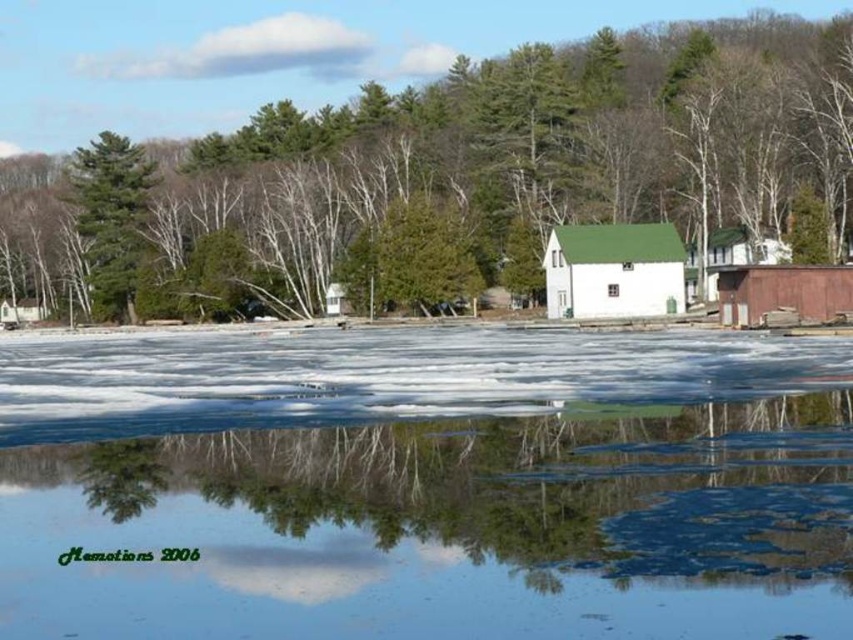
Does translucent ice at center have a larger size compared to white matte barn at center?

Correct, translucent ice at center is larger in size than white matte barn at center.

Based on the photo, who is lower down, translucent ice at center or white matte barn at center?

Positioned lower is translucent ice at center.

The width and height of the screenshot is (853, 640). I want to click on translucent ice at center, so click(425, 484).

Does point (62, 548) lie in front of point (90, 196)?

Yes, it is.

Which is more to the right, translucent ice at center or green textured pine tree at left?

Positioned to the right is translucent ice at center.

Find the location of a particular element. This screenshot has width=853, height=640. translucent ice at center is located at coordinates (425, 484).

This screenshot has width=853, height=640. What are the coordinates of `translucent ice at center` in the screenshot? It's located at (425, 484).

Can you confirm if translucent ice at center is smaller than green leafy tree at center?

Indeed, translucent ice at center has a smaller size compared to green leafy tree at center.

Describe the element at coordinates (425, 484) in the screenshot. The height and width of the screenshot is (640, 853). I see `translucent ice at center` at that location.

What do you see at coordinates (425, 484) in the screenshot?
I see `translucent ice at center` at bounding box center [425, 484].

This screenshot has width=853, height=640. Identify the location of translucent ice at center. (425, 484).